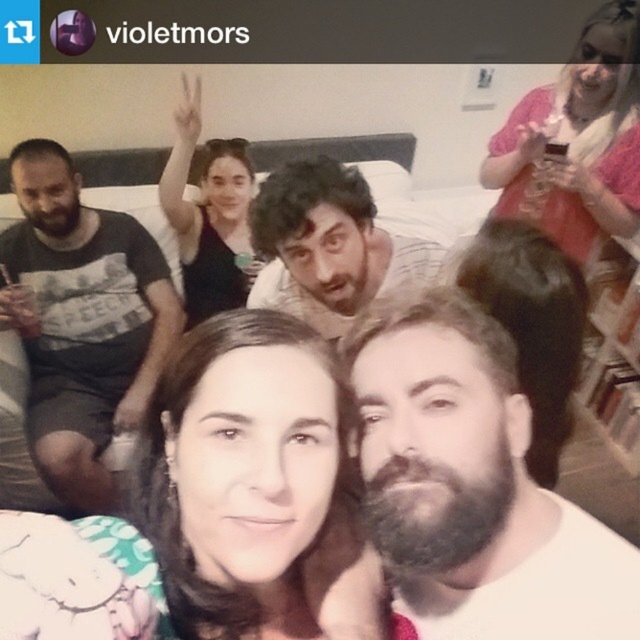
Who is more distant from viewer, (125, 381) or (339, 164)?

The point (125, 381) is behind.

Measure the distance between matte black t-shirt at left and camera.

They are 5.91 feet apart.

This screenshot has height=640, width=640. What are the coordinates of `matte black t-shirt at left` in the screenshot? It's located at (81, 321).

Is point (371, 556) farther from camera compared to point (113, 396)?

No.

Does smooth brown hair at center have a lesser width compared to matte black t-shirt at left?

Correct, smooth brown hair at center's width is less than matte black t-shirt at left's.

What do you see at coordinates (216, 508) in the screenshot?
I see `smooth brown hair at center` at bounding box center [216, 508].

Locate an element on the screen. smooth brown hair at center is located at coordinates (216, 508).

Who is shorter, smooth brown hair at center or matte black shirt at center?

smooth brown hair at center

Can you confirm if smooth brown hair at center is shorter than matte black shirt at center?

Indeed, smooth brown hair at center has a lesser height compared to matte black shirt at center.

Who is more distant from viewer, (218, 547) or (234, 259)?

Positioned behind is point (234, 259).

Locate an element on the screen. The image size is (640, 640). smooth brown hair at center is located at coordinates (216, 508).